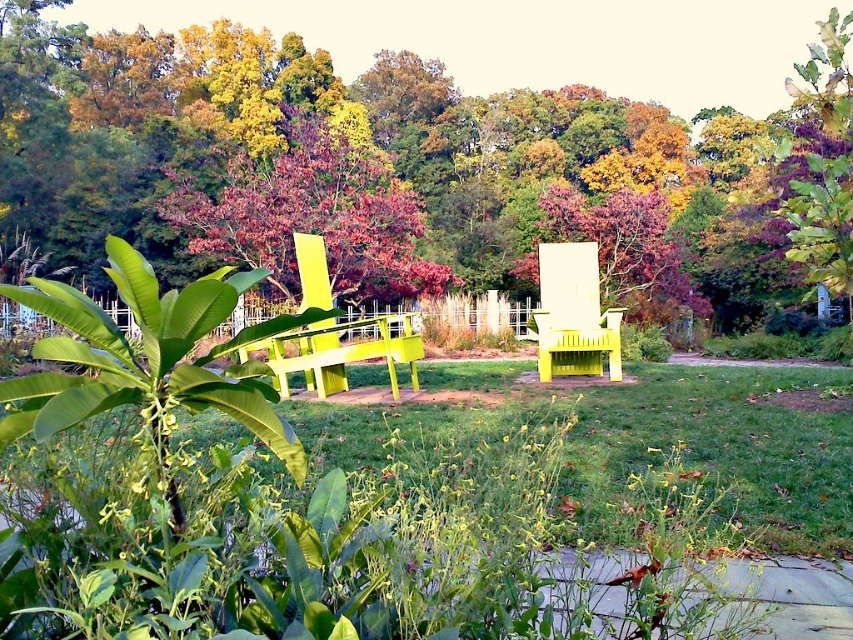
Which is in front, point (508, 408) or point (276, 339)?

Point (508, 408)

Image resolution: width=853 pixels, height=640 pixels. Describe the element at coordinates (648, 440) in the screenshot. I see `green grass at center` at that location.

Between point (654, 385) and point (315, 388), which one is positioned in front?

Point (315, 388)

Find the location of `green grass at center`. green grass at center is located at coordinates (648, 440).

Which is more to the right, green matte bench at center or bright yellow plastic chair at center?

Positioned to the right is bright yellow plastic chair at center.

Is point (230, 33) positioned in front of point (375, 346)?

That is False.

Does point (369, 236) come in front of point (289, 365)?

That is False.

Locate an element on the screen. The height and width of the screenshot is (640, 853). green matte bench at center is located at coordinates (381, 170).

Is green matte bench at center bigger than yellow matte chair at center?

Indeed, green matte bench at center has a larger size compared to yellow matte chair at center.

Is point (178, 205) closer to camera compared to point (589, 312)?

No, (178, 205) is behind (589, 312).

Identify the location of green matte bench at center. (381, 170).